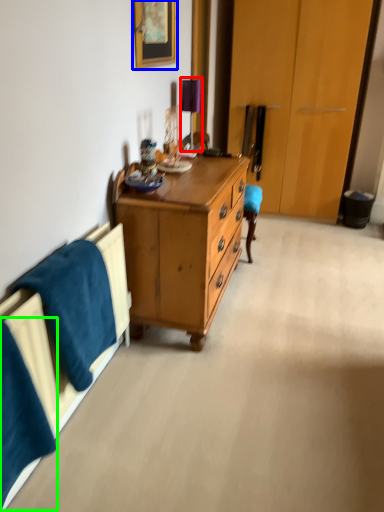
Question: Considering the real-world distances, which object is closest to table lamp (highlighted by a red box)? picture frame (highlighted by a blue box) or blanket (highlighted by a green box).

Choices:
 (A) picture frame
 (B) blanket

Answer: (A)